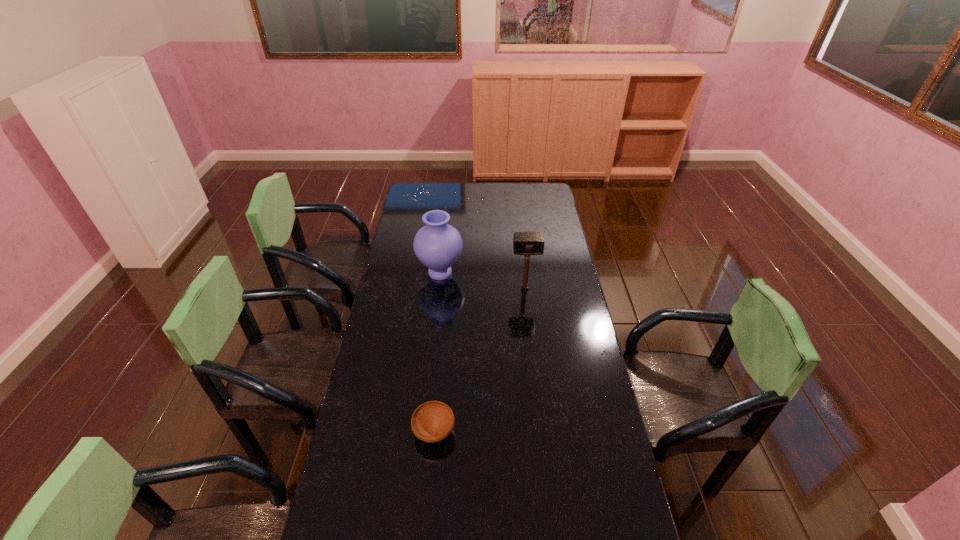
At what (x,y) coordinates should I click in order to perform the action: click on free space at the right edge of the desktop. Please return your answer as a coordinate pair (x, y). Looking at the image, I should click on (577, 410).

Locate an element on the screen. Image resolution: width=960 pixels, height=540 pixels. free space at the far left corner is located at coordinates (419, 198).

I want to click on vacant region at the far right corner of the desktop, so click(531, 193).

Find the location of a particular element. free space that is in between the bowl and the vase is located at coordinates (437, 352).

I want to click on empty space that is in between the vase and the nearest object, so click(x=437, y=352).

This screenshot has width=960, height=540. I want to click on vacant space that is in between the nearest object and the rightmost object, so click(x=479, y=360).

Identify the location of blank region between the vase and the rightmost object. The height and width of the screenshot is (540, 960). (482, 281).

You are a GUI agent. You are given a task and a screenshot of the screen. Output one action in this format:
    pyautogui.click(x=<x>, y=<y>)
    Task: Click on the free space that is in between the bowl and the mallet
    This screenshot has height=540, width=960.
    Given the screenshot: What is the action you would take?
    pyautogui.click(x=479, y=360)

Where is `vacant area between the shortest object and the vase`? This screenshot has height=540, width=960. vacant area between the shortest object and the vase is located at coordinates (437, 352).

You are a GUI agent. You are given a task and a screenshot of the screen. Output one action in this format:
    pyautogui.click(x=<x>, y=<y>)
    Task: Click on the vacant region between the vase and the rightmost object
    
    Given the screenshot: What is the action you would take?
    pyautogui.click(x=482, y=281)